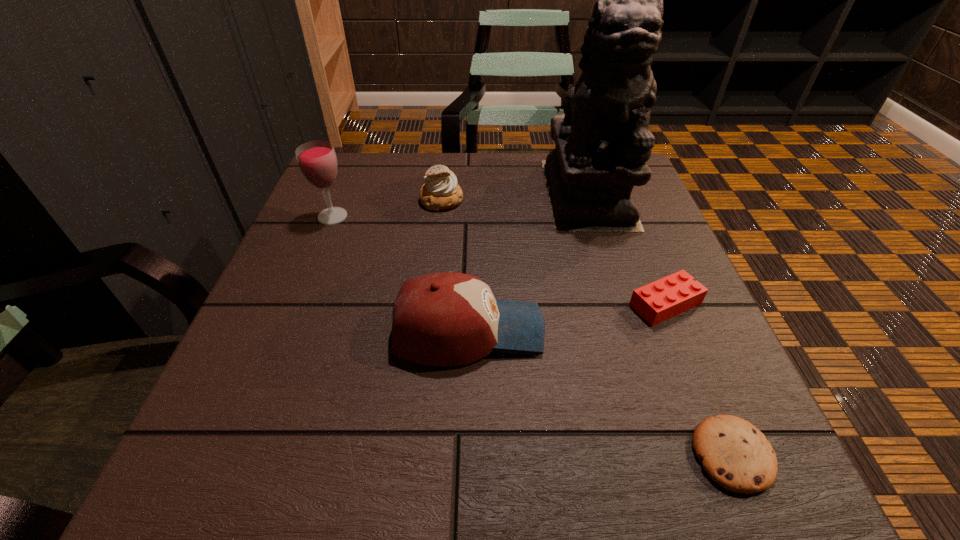
The image size is (960, 540). Identify the location of the tallest object. (603, 142).

The height and width of the screenshot is (540, 960). I want to click on the fifth shortest object, so click(x=317, y=161).

Locate an element on the screen. Image resolution: width=960 pixels, height=540 pixels. the leftmost object is located at coordinates (317, 161).

Where is `the third tallest object`? the third tallest object is located at coordinates (444, 319).

Image resolution: width=960 pixels, height=540 pixels. Identify the location of the fourth tallest object. click(440, 192).

Locate an element on the screen. the fifth tallest object is located at coordinates (656, 302).

Find the location of a particular element. The height and width of the screenshot is (540, 960). the nearest object is located at coordinates (736, 455).

You are a GUI agent. You are given a task and a screenshot of the screen. Output one action in this format:
    pyautogui.click(x=<x>, y=<y>)
    Task: Click on the shortest object
    This screenshot has width=960, height=540.
    Given the screenshot: What is the action you would take?
    pyautogui.click(x=736, y=455)

Where is `free space located 0.220m on the front-facing side of the sculpture`? This screenshot has height=540, width=960. free space located 0.220m on the front-facing side of the sculpture is located at coordinates (624, 309).

I want to click on free location located on the right of the leftmost object, so click(403, 217).